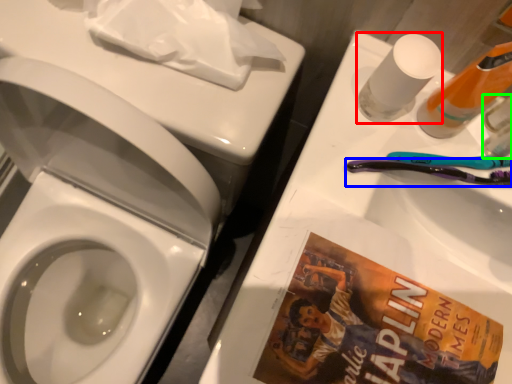
Question: Which is farther away from mouthwash (highlighted by a red box)? toothbrush (highlighted by a blue box) or mouthwash (highlighted by a green box)?

Choices:
 (A) toothbrush
 (B) mouthwash

Answer: (B)